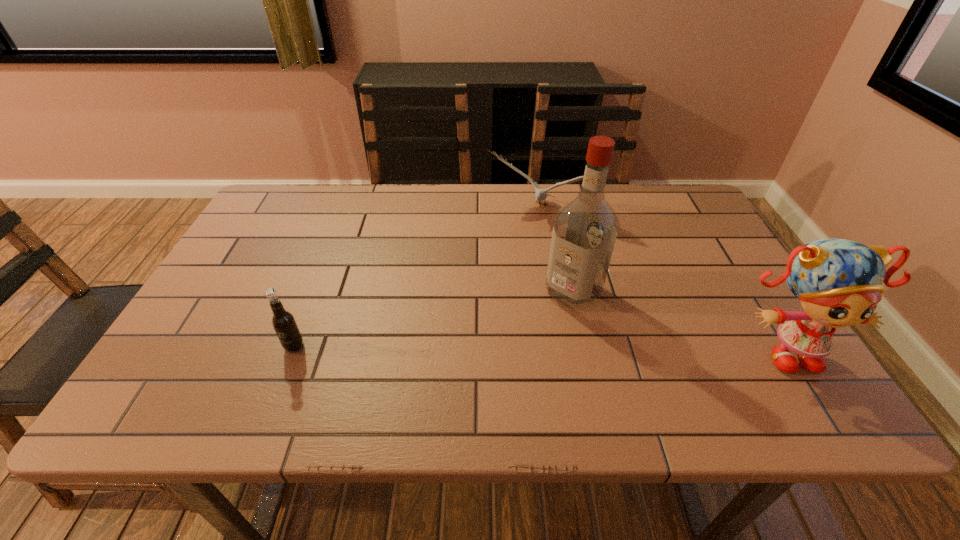
Find the location of a particular element. The width and height of the screenshot is (960, 540). vacant space at the left edge of the desktop is located at coordinates (204, 309).

In order to click on vacant region at the right edge in this screenshot , I will do `click(759, 340)`.

In the image, there is a desktop. Identify the location of vacant space at the far left corner. (268, 211).

At what (x,y) coordinates should I click in order to perform the action: click on blank space at the near left corner. Please return your answer as a coordinate pair (x, y). The width and height of the screenshot is (960, 540). Looking at the image, I should click on (205, 375).

The image size is (960, 540). Identify the location of vacant point at the far right corner. (671, 216).

I want to click on blank space at the near right corner, so click(760, 346).

Where is `empty space that is in between the tallest object and the rightmost object`? empty space that is in between the tallest object and the rightmost object is located at coordinates (679, 320).

Locate an element on the screen. free spot between the doll and the gull is located at coordinates (661, 279).

Locate an element on the screen. free spot between the doll and the gull is located at coordinates (661, 279).

In order to click on free spot between the leftmost object and the doll in this screenshot , I will do [539, 347].